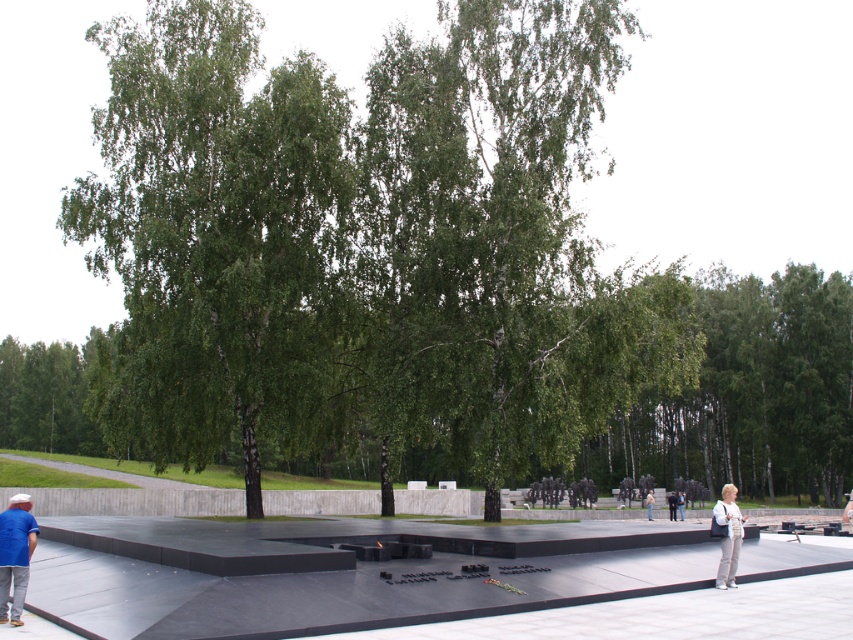
Question: Which object is closer to the camera taking this photo?

Choices:
 (A) dark gray pants at lower right
 (B) green leafy tree at center
 (C) white fabric bag at lower right

Answer: (C)

Question: Is light beige pants at center below light beige jacket at lower right?

Choices:
 (A) yes
 (B) no

Answer: (A)

Question: Among these points, which one is nearest to the camera?

Choices:
 (A) (16, 572)
 (B) (231, 20)
 (C) (672, 515)

Answer: (A)

Question: Observing the image, what is the correct spatial positioning of dark gray pants at lower right in reference to light beige jacket at lower right?

Choices:
 (A) above
 (B) below

Answer: (A)

Question: Which point is farther from the camera taking this photo?

Choices:
 (A) (653, 496)
 (B) (733, 518)

Answer: (A)

Question: Can you confirm if dark gray pants at lower right is wider than light beige pants at center?

Choices:
 (A) yes
 (B) no

Answer: (B)